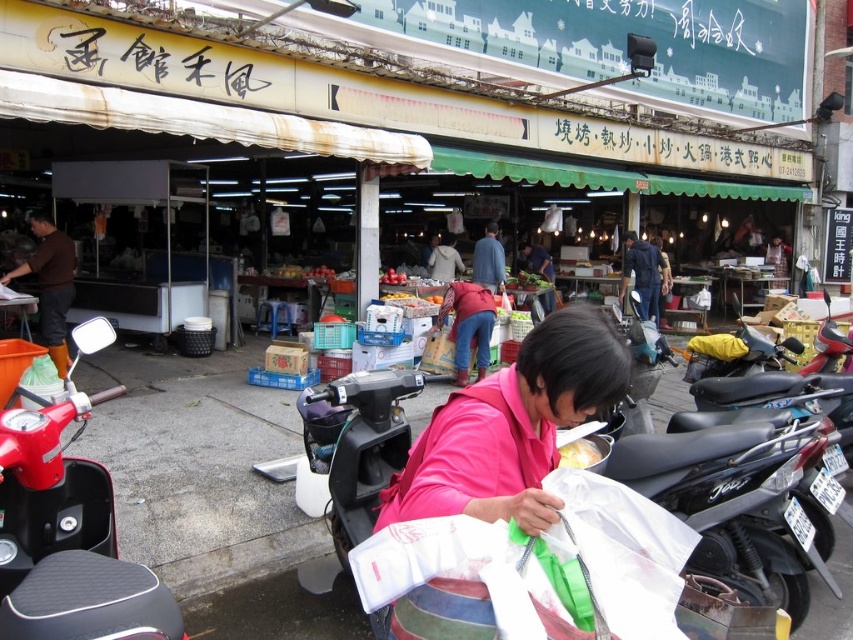
Question: Can you confirm if denim pants at center is positioned to the right of blue denim jacket at center?

Choices:
 (A) no
 (B) yes

Answer: (A)

Question: Which object is the farthest from the blue denim jacket at center?

Choices:
 (A) brown leather boots at left
 (B) dark blue jeans at center
 (C) white glossy bowl at center
 (D) denim pants at center

Answer: (C)

Question: Which point is closer to the camera?

Choices:
 (A) white glossy bowl at center
 (B) pink matte shirt at center
 (C) black matte scooter at center
 (D) blue jeans at center

Answer: (B)

Question: Can you confirm if gray fabric jacket at center is bigger than matte red jacket at center?

Choices:
 (A) yes
 (B) no

Answer: (B)

Question: Is red matte motorcycle at lower left positioned before pink matte shirt at center?

Choices:
 (A) no
 (B) yes

Answer: (B)

Question: Considering the real-world distances, which object is closest to the blue jeans at center?

Choices:
 (A) black matte scooter at center
 (B) red matte motorcycle at lower left

Answer: (A)